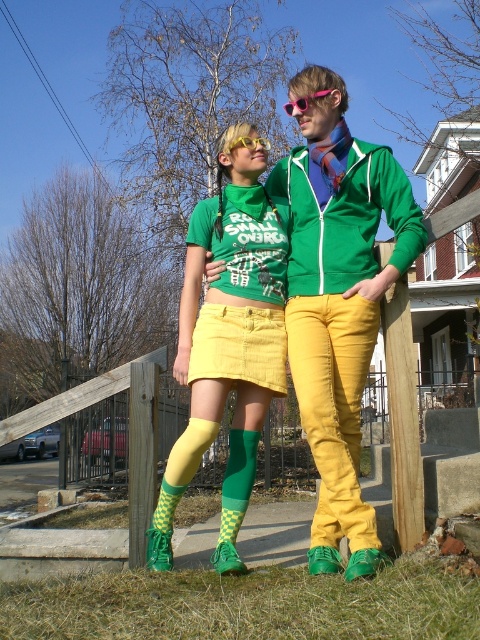
Question: Among these objects, which one is farthest from the camera?

Choices:
 (A) pink plastic goggles at upper center
 (B) matte green socks at center
 (C) matte yellow skirt at center
 (D) green checkered sock at center

Answer: (A)

Question: Is green checkered socks at center closer to camera compared to green checkered sock at center?

Choices:
 (A) yes
 (B) no

Answer: (A)

Question: Considering the real-world distances, which object is farthest from the green checkered sock at center?

Choices:
 (A) yellow plastic goggles at upper center
 (B) pink plastic goggles at upper center

Answer: (B)

Question: Among these points, which one is nearest to the camera?

Choices:
 (A) (247, 138)
 (B) (297, 99)
 (C) (240, 465)

Answer: (C)

Question: Can you confirm if green checkered sock at center is bigger than yellow plastic goggles at upper center?

Choices:
 (A) yes
 (B) no

Answer: (A)

Question: Can you confirm if matte yellow skirt at center is positioned to the right of green checkered socks at center?

Choices:
 (A) no
 (B) yes

Answer: (B)